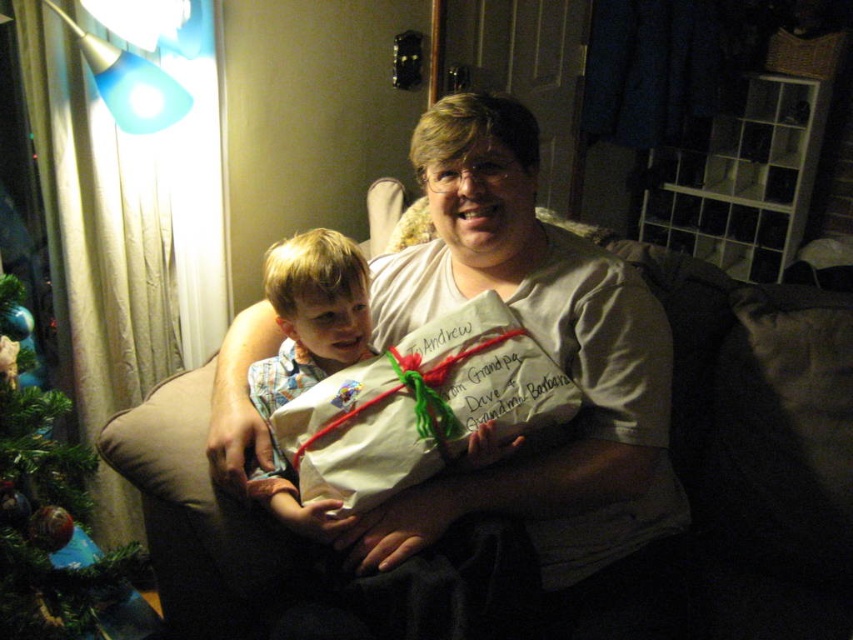
You are a photographer standing in the room and want to take a picture of the green matte christmas tree at left and the light brown fabric shirt at center. Which object should you focus on first if you want to capture both in the same frame without moving the camera?

The green matte christmas tree at left is below the light brown fabric shirt at center, so you should focus on the light brown fabric shirt at center first to ensure both are in the frame.

You are planning to place a new decorative pillow on the brown fabric couch at center. Considering the white paper gift at center is already on the couch, will the couch have enough space for the pillow without overlapping the gift?

The brown fabric couch at center is wider than the white paper gift at center, so there should be enough space to place the decorative pillow without overlapping the gift.

You are standing in the room and want to place a small decoration on the closest point between point (0, 451) and point (294, 317). Which point should you choose?

Point (0, 451) is closer to the viewer than point (294, 317), so you should choose point (0, 451).